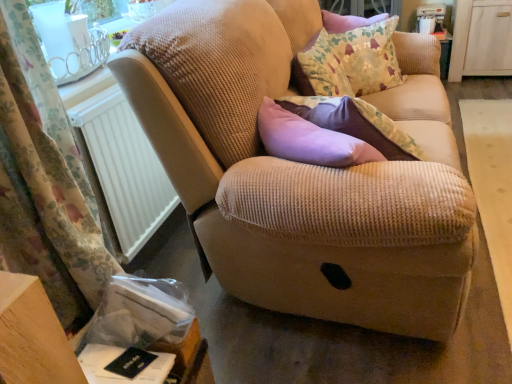
Question: Is white wood dresser at upper right wider than white plastic radiator at left?

Choices:
 (A) no
 (B) yes

Answer: (B)

Question: Is white wood dresser at upper right not within white plastic radiator at left?

Choices:
 (A) no
 (B) yes

Answer: (B)

Question: From a real-world perspective, does white wood dresser at upper right sit lower than white plastic radiator at left?

Choices:
 (A) yes
 (B) no

Answer: (A)

Question: From the image's perspective, is white wood dresser at upper right over white plastic radiator at left?

Choices:
 (A) yes
 (B) no

Answer: (A)

Question: Can you confirm if white wood dresser at upper right is taller than white plastic radiator at left?

Choices:
 (A) no
 (B) yes

Answer: (B)

Question: Is white plastic radiator at left to the left or to the right of floral fabric curtain at left in the image?

Choices:
 (A) right
 (B) left

Answer: (A)

Question: Choose the correct answer: Is white plastic radiator at left inside floral fabric curtain at left or outside it?

Choices:
 (A) outside
 (B) inside

Answer: (A)

Question: Considering their positions, is white plastic radiator at left located in front of or behind floral fabric curtain at left?

Choices:
 (A) front
 (B) behind

Answer: (B)

Question: Is white plastic radiator at left taller or shorter than floral fabric curtain at left?

Choices:
 (A) tall
 (B) short

Answer: (B)

Question: From their relative heights in the image, would you say floral fabric curtain at left is taller or shorter than white plastic radiator at left?

Choices:
 (A) short
 (B) tall

Answer: (B)

Question: In the image, is floral fabric curtain at left positioned in front of or behind white plastic radiator at left?

Choices:
 (A) behind
 (B) front

Answer: (B)

Question: Is floral fabric curtain at left inside the boundaries of white plastic radiator at left, or outside?

Choices:
 (A) outside
 (B) inside

Answer: (A)

Question: From the image's perspective, relative to white plastic radiator at left, is floral fabric curtain at left above or below?

Choices:
 (A) above
 (B) below

Answer: (B)

Question: Is floral fabric cushion at upper right situated inside white plastic radiator at left or outside?

Choices:
 (A) outside
 (B) inside

Answer: (A)

Question: From a real-world perspective, is floral fabric cushion at upper right above or below white plastic radiator at left?

Choices:
 (A) below
 (B) above

Answer: (B)